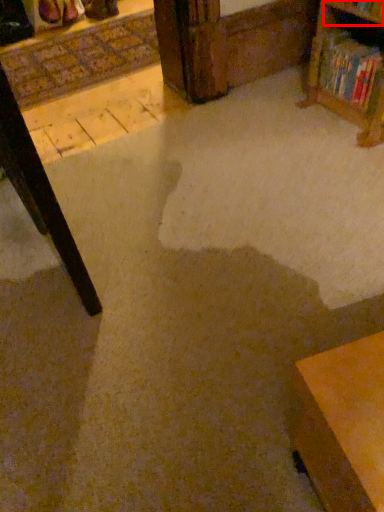
Question: From the image's perspective, what is the correct spatial relationship of shelf (annotated by the red box) in relation to book?

Choices:
 (A) above
 (B) below

Answer: (A)